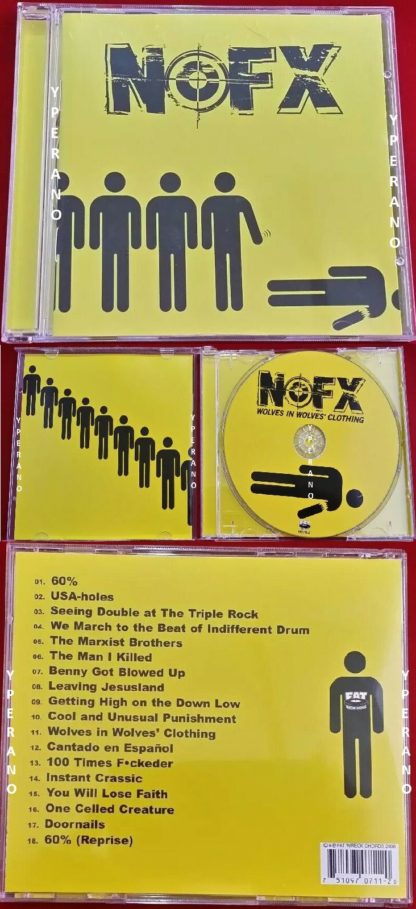
Find the location of a particular element. This screenshot has width=416, height=909. cd is located at coordinates (347, 451).